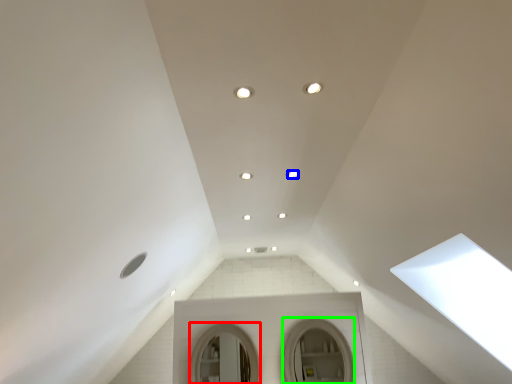
Question: Based on their relative distances, which object is farther from mirror (highlighted by a red box)? Choose from lighting (highlighted by a blue box) and mirror (highlighted by a green box).

Choices:
 (A) lighting
 (B) mirror

Answer: (A)